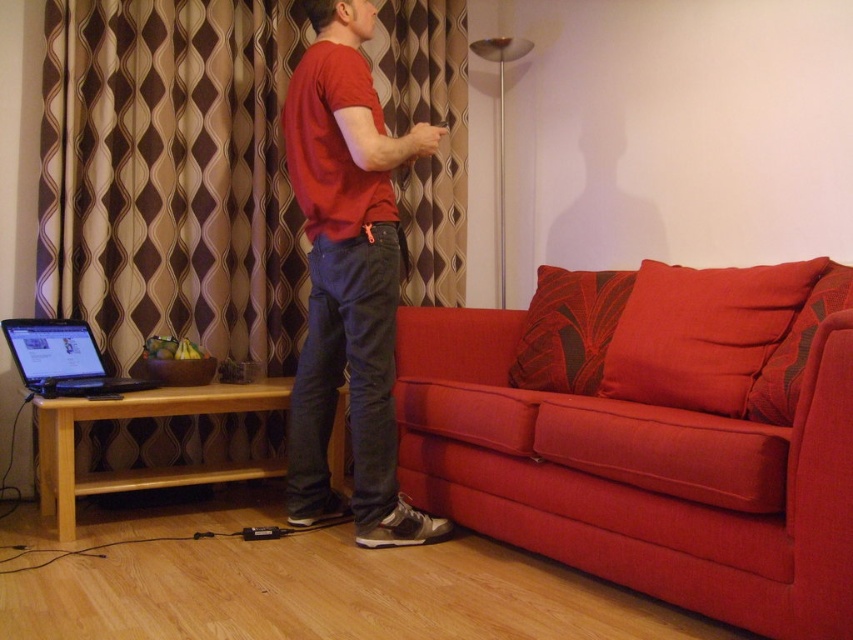
You are a delivery person who needs to place a package on the matte black laptop at left without disturbing the laptop. Which direction should you approach from to avoid hitting the brown textured curtain at upper left?

You should approach from the left side of the matte black laptop at left to avoid hitting the brown textured curtain at upper left, since the brown textured curtain at upper left is located to the right of the matte black laptop at left.

You are trying to hang a picture frame between the brown textured curtain at upper left and the matte black laptop at left. Which object should you place the frame closer to if you want it centered between them?

The brown textured curtain at upper left is wider than the matte black laptop at left. To center the picture frame between them, place it closer to the matte black laptop at left since the curtain takes up more space on the left side.